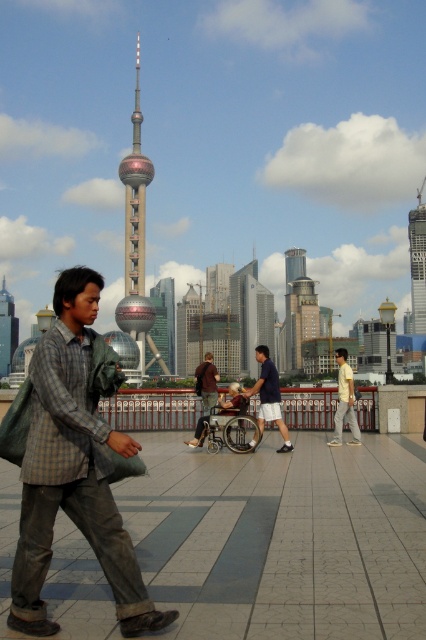
Does plaid fabric shirt at center appear on the right side of brown fabric jacket at center?

No, plaid fabric shirt at center is not to the right of brown fabric jacket at center.

Can you confirm if plaid fabric shirt at center is bigger than brown fabric jacket at center?

Yes, plaid fabric shirt at center is bigger than brown fabric jacket at center.

Between point (140, 586) and point (213, 387), which one is positioned behind?

Point (213, 387)

Identify the location of plaid fabric shirt at center. This screenshot has height=640, width=426. (74, 467).

Who is taller, glassy steel skyscraper at center or brown fabric jacket at center?

glassy steel skyscraper at center

Is point (420, 288) positioned before point (201, 432)?

No.

You are a GUI agent. You are given a task and a screenshot of the screen. Output one action in this format:
    pyautogui.click(x=<x>, y=<y>)
    Task: Click on the glassy steel skyscraper at center
    The height and width of the screenshot is (640, 426).
    Given the screenshot: What is the action you would take?
    pyautogui.click(x=417, y=262)

Which is more to the right, dark blue cotton shirt at center or yellow cotton shirt at center?

From the viewer's perspective, yellow cotton shirt at center appears more on the right side.

Does dark blue cotton shirt at center come in front of yellow cotton shirt at center?

That is True.

Does point (273, 412) lie behind point (342, 352)?

No, it is in front of (342, 352).

The height and width of the screenshot is (640, 426). I want to click on dark blue cotton shirt at center, so click(x=268, y=396).